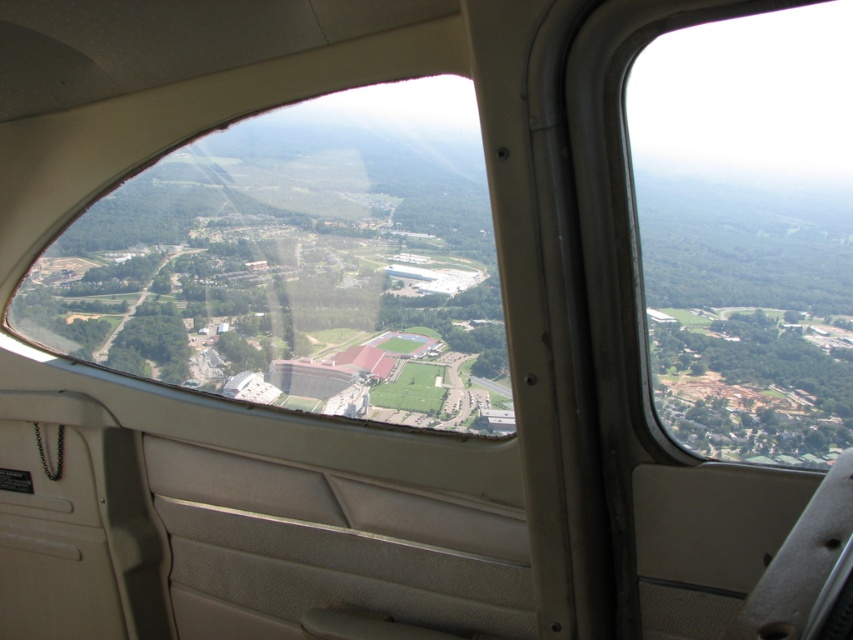
Does transparent glass airplane window at center have a larger size compared to transparent glass airplane window at upper right?

No.

Which is above, transparent glass airplane window at center or transparent glass airplane window at upper right?

transparent glass airplane window at upper right is higher up.

Describe the element at coordinates (299, 264) in the screenshot. I see `transparent glass airplane window at center` at that location.

Where is `transparent glass airplane window at center`? Image resolution: width=853 pixels, height=640 pixels. transparent glass airplane window at center is located at coordinates [x=299, y=264].